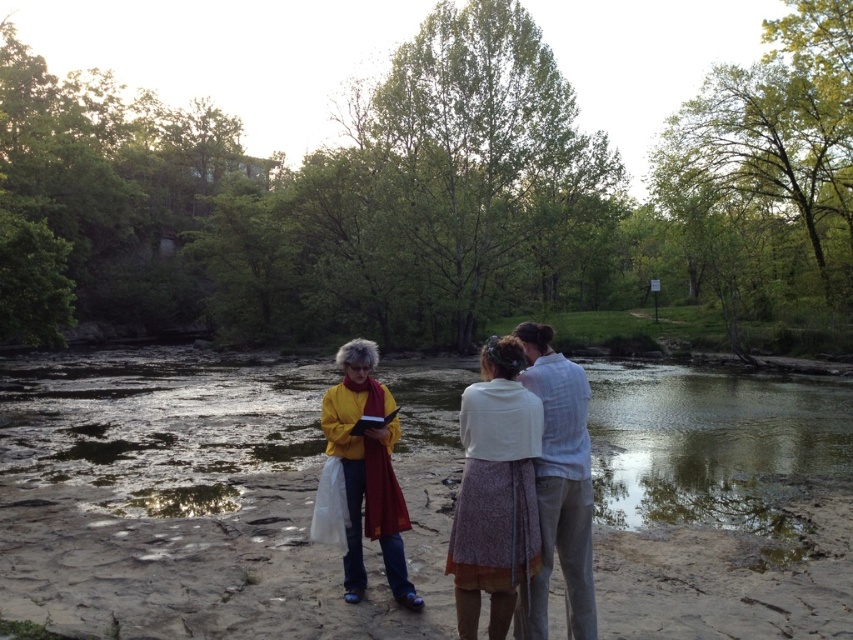
Question: Which point is farther to the camera?

Choices:
 (A) (517, 513)
 (B) (531, 397)
 (C) (556, 432)
 (D) (387, 545)

Answer: (D)

Question: Which of the following is the closest to the observer?

Choices:
 (A) (338, 387)
 (B) (538, 573)
 (C) (479, 388)
 (D) (550, 538)

Answer: (B)

Question: Can you confirm if white cotton dress at center is positioned to the left of yellow matte sweater at center?

Choices:
 (A) no
 (B) yes

Answer: (A)

Question: Is white cotton dress at center smaller than white textured blouse at center?

Choices:
 (A) no
 (B) yes

Answer: (A)

Question: Which point is farther to the camera?

Choices:
 (A) light blue cotton shirt at center
 (B) white cotton dress at center
 (C) white textured blouse at center

Answer: (A)

Question: Does white cotton dress at center appear on the left side of yellow matte sweater at center?

Choices:
 (A) no
 (B) yes

Answer: (A)